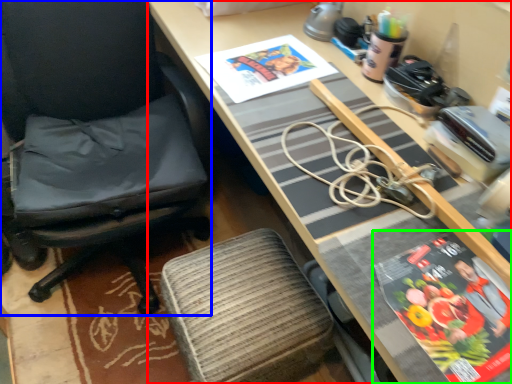
Question: Estimate the real-world distances between objects in this image. Which object is farther from desk (highlighted by a red box), chair (highlighted by a blue box) or paperback book (highlighted by a green box)?

Choices:
 (A) chair
 (B) paperback book

Answer: (A)